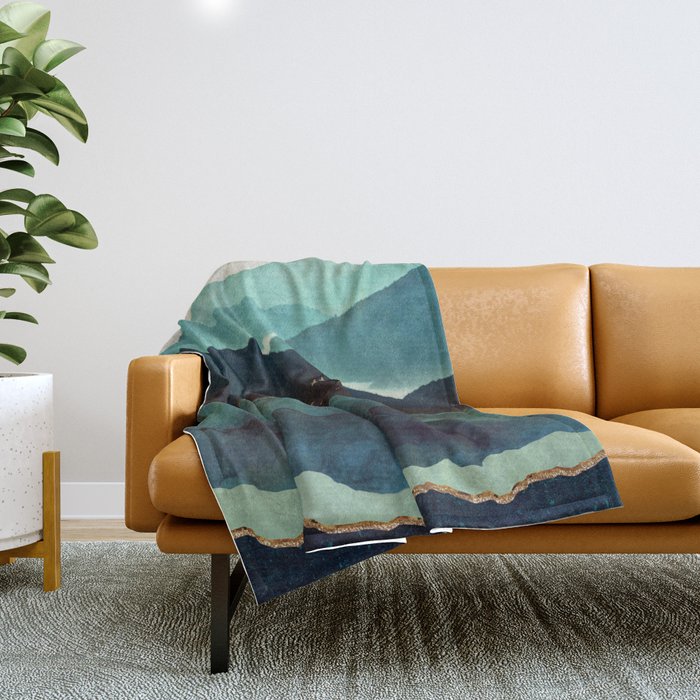
Find the location of a particular element. plant holder is located at coordinates (46, 540).